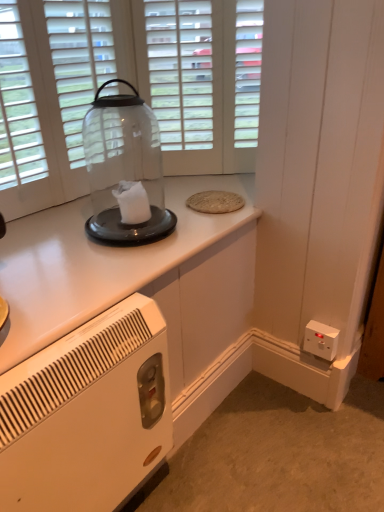
This screenshot has width=384, height=512. Describe the element at coordinates (202, 80) in the screenshot. I see `transparent glass door at upper center` at that location.

Find the location of `transparent glass jar at center`. transparent glass jar at center is located at coordinates (125, 170).

You are a GUI agent. You are given a task and a screenshot of the screen. Output one action in this format:
    pyautogui.click(x=<x>, y=<y>)
    Task: Click on the transparent glass door at upper center
    
    Given the screenshot: What is the action you would take?
    pyautogui.click(x=202, y=80)

Considering the sizes of transparent glass door at upper center and transparent glass jar at center in the image, is transparent glass door at upper center taller or shorter than transparent glass jar at center?

transparent glass door at upper center is taller than transparent glass jar at center.

Which is closer to the camera, (216, 124) or (105, 106)?

Point (216, 124).

In order to click on glass jar in front of the transparent glass door at upper center in this screenshot , I will do `click(125, 170)`.

Is transparent glass door at upper center facing away from transparent glass jar at center?

No.

In the scene shown: Which of these two, white plastic heater at lower left or transparent glass jar at center, is wider?

With larger width is transparent glass jar at center.

Is white plastic heater at lower left not close to transparent glass jar at center?

No, white plastic heater at lower left is not far away from transparent glass jar at center.

Is white plastic heater at lower left situated inside transparent glass jar at center or outside?

white plastic heater at lower left cannot be found inside transparent glass jar at center.

From a real-world perspective, is white plastic heater at lower left above or below transparent glass jar at center?

From a real-world perspective, white plastic heater at lower left is physically below transparent glass jar at center.

Looking at this image, from a real-world perspective, is transparent glass jar at center positioned over white plastic heater at lower left based on gravity?

Yes, from a real-world perspective, transparent glass jar at center is on top of white plastic heater at lower left.

How many degrees apart are the facing directions of transparent glass jar at center and white plastic heater at lower left?

There is a 1.03-degree angle between the facing directions of transparent glass jar at center and white plastic heater at lower left.

Is transparent glass jar at center taller than white plastic heater at lower left?

In fact, transparent glass jar at center may be shorter than white plastic heater at lower left.

Can you confirm if transparent glass jar at center is thinner than transparent glass door at upper center?

No, transparent glass jar at center is not thinner than transparent glass door at upper center.

Is transparent glass jar at center at the right side of transparent glass door at upper center?

Incorrect, transparent glass jar at center is not on the right side of transparent glass door at upper center.

Is point (88, 153) less distant than point (242, 120)?

Yes, it is.

Is transparent glass jar at center aimed at transparent glass door at upper center?

No, transparent glass jar at center does not turn towards transparent glass door at upper center.

Is point (166, 24) more distant than point (33, 335)?

Yes, it is.

Is transparent glass door at upper center inside the boundaries of white glossy cabinet at upper center, or outside?

transparent glass door at upper center lies outside white glossy cabinet at upper center.

Does transparent glass door at upper center have a greater width compared to white glossy cabinet at upper center?

In fact, transparent glass door at upper center might be narrower than white glossy cabinet at upper center.

Can you confirm if transparent glass door at upper center is taller than white glossy cabinet at upper center?

Correct, transparent glass door at upper center is much taller as white glossy cabinet at upper center.

Considering the positions of objects transparent glass door at upper center and white plastic heater at lower left in the image provided, who is more to the right, transparent glass door at upper center or white plastic heater at lower left?

transparent glass door at upper center.

Is transparent glass door at upper center far from white plastic heater at lower left?

They are positioned close to each other.

Can you tell me how much transparent glass door at upper center and white plastic heater at lower left differ in facing direction?

They differ by 45.2 degrees in their facing directions.

Is white plastic heater at lower left outside of white glossy cabinet at upper center?

Yes, white plastic heater at lower left is not within white glossy cabinet at upper center.

Can you confirm if white plastic heater at lower left is positioned to the right of white glossy cabinet at upper center?

No, white plastic heater at lower left is not to the right of white glossy cabinet at upper center.

Which is in front, white plastic heater at lower left or white glossy cabinet at upper center?

white plastic heater at lower left.

Is white plastic heater at lower left facing towards white glossy cabinet at upper center?

No, white plastic heater at lower left is not oriented towards white glossy cabinet at upper center.

Identify the location of glass door on the right of transparent glass jar at center. (202, 80).

Locate an element on the screen. home appliance that is on the left side of transparent glass jar at center is located at coordinates (87, 414).

When comparing their distances from transparent glass door at upper center, does white plastic heater at lower left or white glossy cabinet at upper center seem further?

white plastic heater at lower left is positioned further to the anchor transparent glass door at upper center.

Consider the image. Considering their positions, is transparent glass jar at center positioned closer to transparent glass door at upper center than white plastic heater at lower left?

The object closer to transparent glass door at upper center is transparent glass jar at center.

Estimate the real-world distances between objects in this image. Which object is further from transparent glass door at upper center, transparent glass jar at center or white plastic electrical outlet at lower right?

white plastic electrical outlet at lower right.

Which object lies nearer to the anchor point transparent glass door at upper center, transparent glass jar at center or white glossy cabinet at upper center?

Based on the image, transparent glass jar at center appears to be nearer to transparent glass door at upper center.

Which object lies nearer to the anchor point white plastic heater at lower left, white glossy cabinet at upper center or white plastic electrical outlet at lower right?

Answer: white glossy cabinet at upper center is positioned closer to the anchor white plastic heater at lower left.

Estimate the real-world distances between objects in this image. Which object is further from white plastic heater at lower left, transparent glass door at upper center or transparent glass jar at center?

transparent glass door at upper center.

Which object lies further to the anchor point transparent glass jar at center, transparent glass door at upper center or white glossy cabinet at upper center?

Based on the image, transparent glass door at upper center appears to be further to transparent glass jar at center.

Estimate the real-world distances between objects in this image. Which object is further from white glossy cabinet at upper center, transparent glass door at upper center or transparent glass jar at center?

transparent glass door at upper center.

Locate an element on the screen. cabinetry that lies between transparent glass door at upper center and white plastic electrical outlet at lower right from top to bottom is located at coordinates click(x=96, y=263).

Locate an element on the screen. The height and width of the screenshot is (512, 384). electric outlet between transparent glass door at upper center and white plastic heater at lower left in the up-down direction is located at coordinates (321, 340).

Locate an element on the screen. The width and height of the screenshot is (384, 512). glass jar that lies between transparent glass door at upper center and white plastic heater at lower left from top to bottom is located at coordinates (125, 170).

The width and height of the screenshot is (384, 512). I want to click on glass jar between white glossy cabinet at upper center and transparent glass door at upper center in the front-back direction, so click(125, 170).